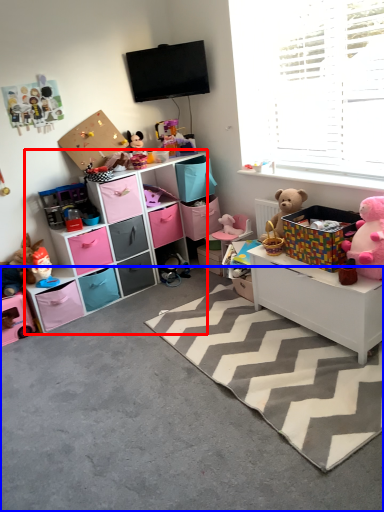
Question: Which point is closer to the camera, shelf (highlighted by a red box) or concrete (highlighted by a blue box)?

Choices:
 (A) shelf
 (B) concrete

Answer: (B)